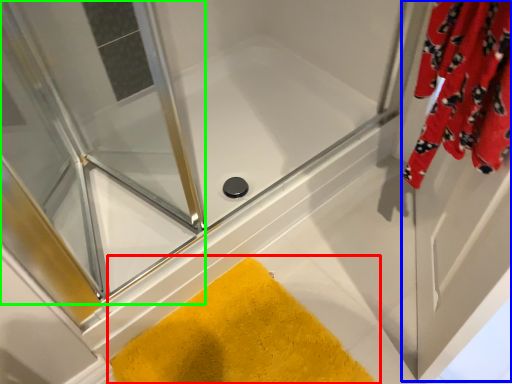
Question: Which is farther away from bath mat (highlighted by a red box)? screen door (highlighted by a blue box) or screen door (highlighted by a green box)?

Choices:
 (A) screen door
 (B) screen door

Answer: (B)